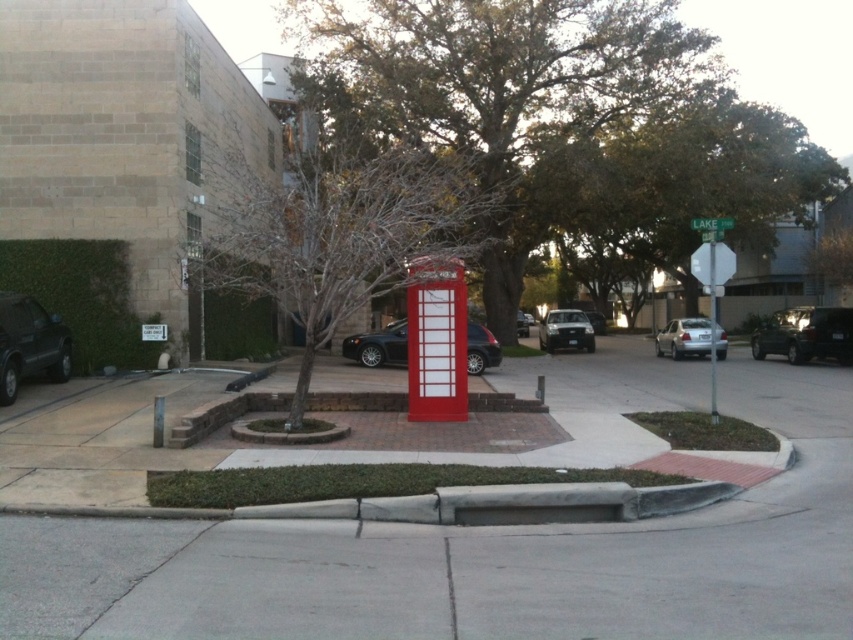
Question: Based on their relative distances, which object is farther from the silver metallic sedan at right?

Choices:
 (A) satin silver sedan at center
 (B) shiny black car at center

Answer: (A)

Question: Which point is farther from the camera taking this photo?

Choices:
 (A) (851, 337)
 (B) (25, 349)
 (C) (601, 314)

Answer: (C)

Question: Which point is closer to the camera taking this photo?

Choices:
 (A) (440, 541)
 (B) (550, 320)

Answer: (A)

Question: Does silver metallic sedan at right have a greater width compared to satin silver sedan at center?

Choices:
 (A) no
 (B) yes

Answer: (B)

Question: Does silver metallic sedan at right appear on the left side of shiny black sedan at center?

Choices:
 (A) yes
 (B) no

Answer: (B)

Question: Does shiny black car at center have a larger size compared to shiny black sedan at center?

Choices:
 (A) no
 (B) yes

Answer: (A)